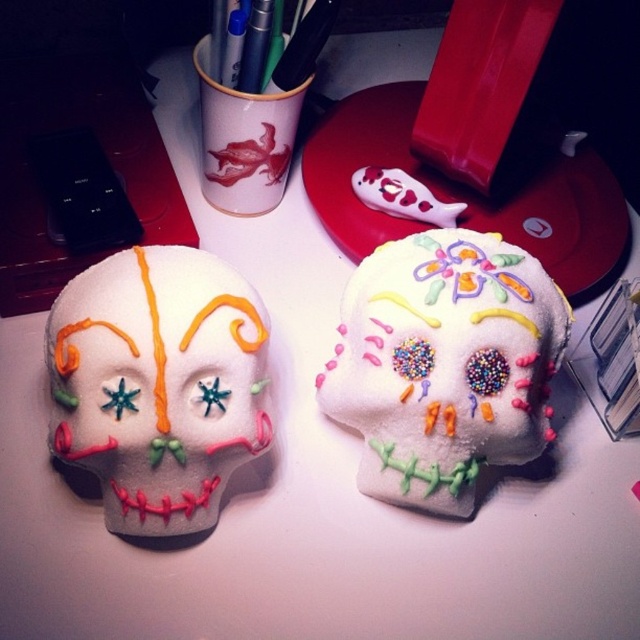
You are an artist looking to place a new decoration between the sugary white skull at center and the matte sugar skull at center. Based on their positions, which skull should you place the new decoration closer to?

The sugary white skull at center is on the right side of the matte sugar skull at center, so to place the new decoration between them, you should position it closer to the matte sugar skull at center.

You are an artist standing in front of the desk with two sugar skulls. You need to place a new decoration exactly at point (157, 385). Which sugar skull should you place it near?

The matte sugar skull at center is located at point (157, 385), so you should place the new decoration near the matte sugar skull at center.

You are an artist planning to place a 10 cm tall figurine between the sugary white skull at center and the matte sugar skull at center on the desk. Based on their heights, will the figurine fit vertically between them without overlapping?

The sugary white skull at center is taller than the matte sugar skull at center. The height difference means there is vertical space between them. Since the figurine is 10 cm tall, it depends on the actual height difference. However, without exact measurements, we can only assume there is enough space. But according to the description, the sugary white skull is taller, so if the figurine is placed between them vertically, it might fit if the height difference allows.